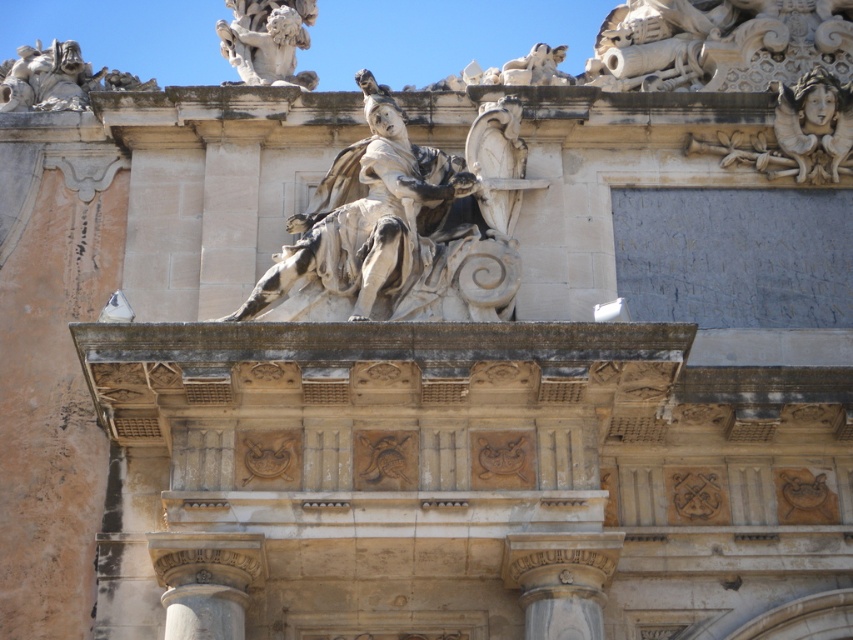
Between white marble statue at center and white stone cherub at upper left, which one appears on the left side from the viewer's perspective?

white stone cherub at upper left is more to the left.

Does point (486, 218) come closer to viewer compared to point (286, 40)?

Yes, point (486, 218) is closer to viewer.

You are a GUI agent. You are given a task and a screenshot of the screen. Output one action in this format:
    pyautogui.click(x=<x>, y=<y>)
    Task: Click on the white marble statue at center
    
    Given the screenshot: What is the action you would take?
    pyautogui.click(x=403, y=227)

Who is shorter, white marble statue at center or white marble column at center?

white marble column at center is shorter.

Can you confirm if white marble statue at center is positioned to the right of white marble column at center?

Incorrect, white marble statue at center is not on the right side of white marble column at center.

Is point (338, 188) closer to viewer compared to point (572, 534)?

No, it is behind (572, 534).

Image resolution: width=853 pixels, height=640 pixels. Find the location of `white marble statue at center`. white marble statue at center is located at coordinates (403, 227).

Who is more distant from viewer, (x=503, y=205) or (x=206, y=568)?

Positioned behind is point (x=503, y=205).

Is white marble statue at center thinner than smooth stone column at lower left?

Incorrect, white marble statue at center's width is not less than smooth stone column at lower left's.

Where is `white marble statue at center`? This screenshot has height=640, width=853. white marble statue at center is located at coordinates (403, 227).